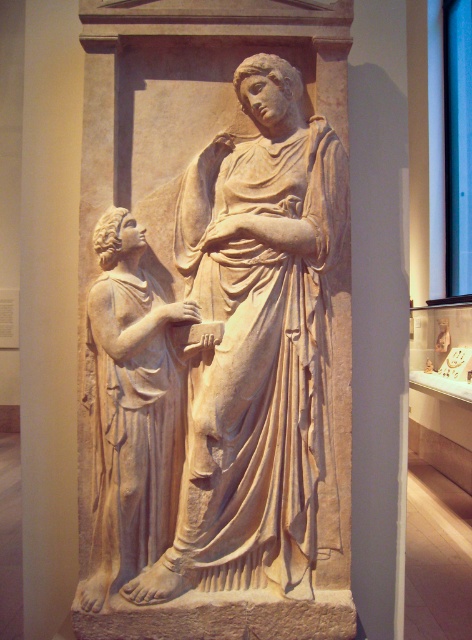
Question: In this image, where is beige stone statue at center located relative to white marble statue at left?

Choices:
 (A) left
 (B) right

Answer: (B)

Question: Which of the following is the closest to the observer?

Choices:
 (A) white marble statue at left
 (B) beige stone statue at center

Answer: (A)

Question: Does beige stone statue at center appear under white marble statue at left?

Choices:
 (A) no
 (B) yes

Answer: (A)

Question: Can you confirm if beige stone statue at center is smaller than white marble statue at left?

Choices:
 (A) yes
 (B) no

Answer: (B)

Question: Which object is farther from the camera taking this photo?

Choices:
 (A) beige stone statue at center
 (B) white marble statue at left

Answer: (A)

Question: Which point is closer to the camera taking this photo?

Choices:
 (A) (190, 449)
 (B) (127, 436)

Answer: (B)